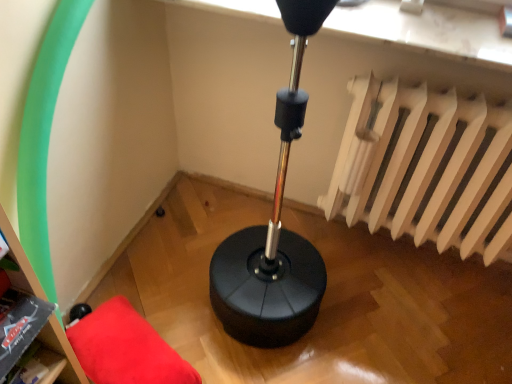
Question: From a real-world perspective, is matte black bookshelf at lower left over red fabric cushion at lower left?

Choices:
 (A) yes
 (B) no

Answer: (A)

Question: Is matte black bookshelf at lower left to the right of red fabric cushion at lower left from the viewer's perspective?

Choices:
 (A) yes
 (B) no

Answer: (B)

Question: Is matte black bookshelf at lower left facing towards red fabric cushion at lower left?

Choices:
 (A) no
 (B) yes

Answer: (A)

Question: Considering the relative positions of matte black bookshelf at lower left and red fabric cushion at lower left in the image provided, is matte black bookshelf at lower left to the left of red fabric cushion at lower left from the viewer's perspective?

Choices:
 (A) no
 (B) yes

Answer: (B)

Question: From the image's perspective, is matte black bookshelf at lower left under red fabric cushion at lower left?

Choices:
 (A) no
 (B) yes

Answer: (A)

Question: From a real-world perspective, is matte black bookshelf at lower left beneath red fabric cushion at lower left?

Choices:
 (A) no
 (B) yes

Answer: (A)

Question: Does red fabric cushion at lower left appear on the left side of matte black bookshelf at lower left?

Choices:
 (A) no
 (B) yes

Answer: (A)

Question: Is red fabric cushion at lower left smaller than matte black bookshelf at lower left?

Choices:
 (A) yes
 (B) no

Answer: (B)

Question: Is red fabric cushion at lower left next to matte black bookshelf at lower left?

Choices:
 (A) yes
 (B) no

Answer: (B)

Question: Considering the relative sizes of red fabric cushion at lower left and matte black bookshelf at lower left in the image provided, is red fabric cushion at lower left bigger than matte black bookshelf at lower left?

Choices:
 (A) yes
 (B) no

Answer: (A)

Question: From the image's perspective, is red fabric cushion at lower left beneath matte black bookshelf at lower left?

Choices:
 (A) no
 (B) yes

Answer: (B)

Question: Does red fabric cushion at lower left have a greater width compared to matte black bookshelf at lower left?

Choices:
 (A) yes
 (B) no

Answer: (A)

Question: Is matte black bookshelf at lower left taller than white matte radiator at upper right?

Choices:
 (A) no
 (B) yes

Answer: (A)